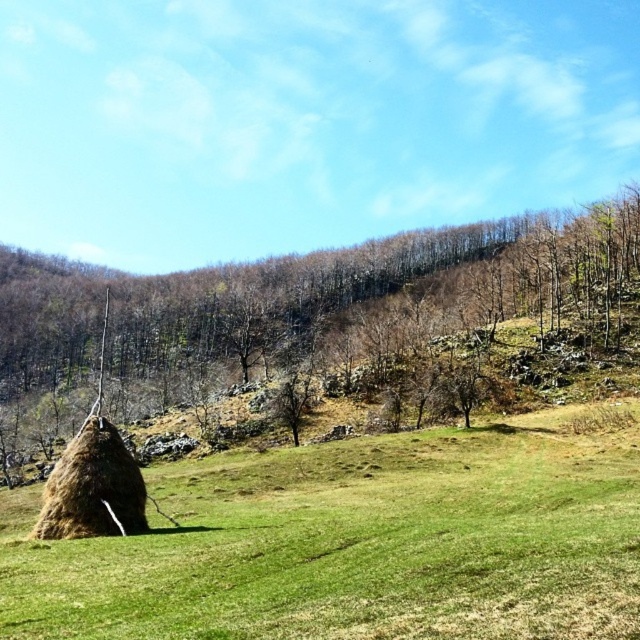
Can you confirm if green grassy field at lower left is thinner than brown textured hay at lower left?

Correct, green grassy field at lower left's width is less than brown textured hay at lower left's.

Does green grassy field at lower left have a lesser height compared to brown textured hay at lower left?

Indeed, green grassy field at lower left has a lesser height compared to brown textured hay at lower left.

Where is `green grassy field at lower left`? The image size is (640, 640). green grassy field at lower left is located at coordinates 356,541.

Image resolution: width=640 pixels, height=640 pixels. I want to click on green grassy field at lower left, so click(x=356, y=541).